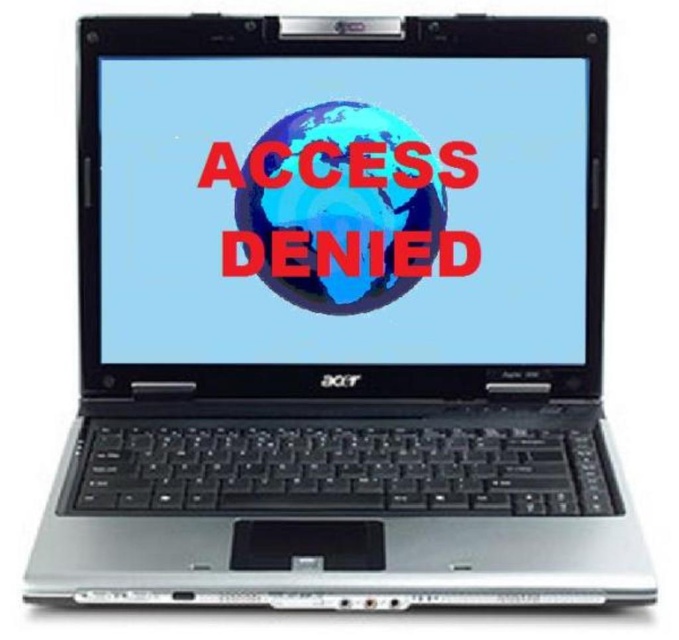
Question: In this image, where is matte plastic screen at center located relative to blue glossy globe at center?

Choices:
 (A) left
 (B) right

Answer: (B)

Question: Among these points, which one is farthest from the camera?

Choices:
 (A) (143, 280)
 (B) (249, 192)

Answer: (B)

Question: Is matte plastic screen at center bigger than blue glossy globe at center?

Choices:
 (A) no
 (B) yes

Answer: (B)

Question: Is the position of matte plastic screen at center less distant than that of blue glossy globe at center?

Choices:
 (A) no
 (B) yes

Answer: (B)

Question: Which of the following is the farthest from the observer?

Choices:
 (A) blue glossy globe at center
 (B) matte plastic screen at center

Answer: (A)